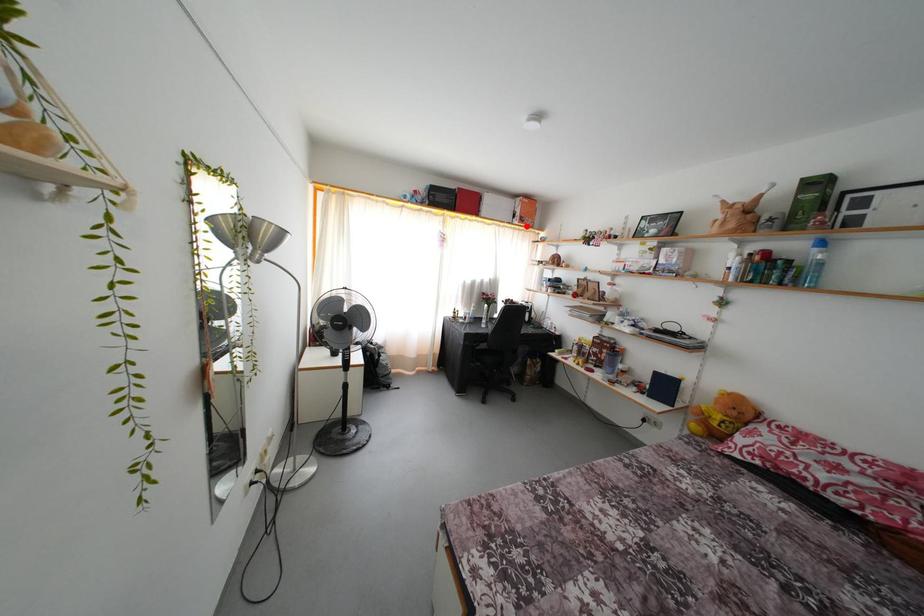
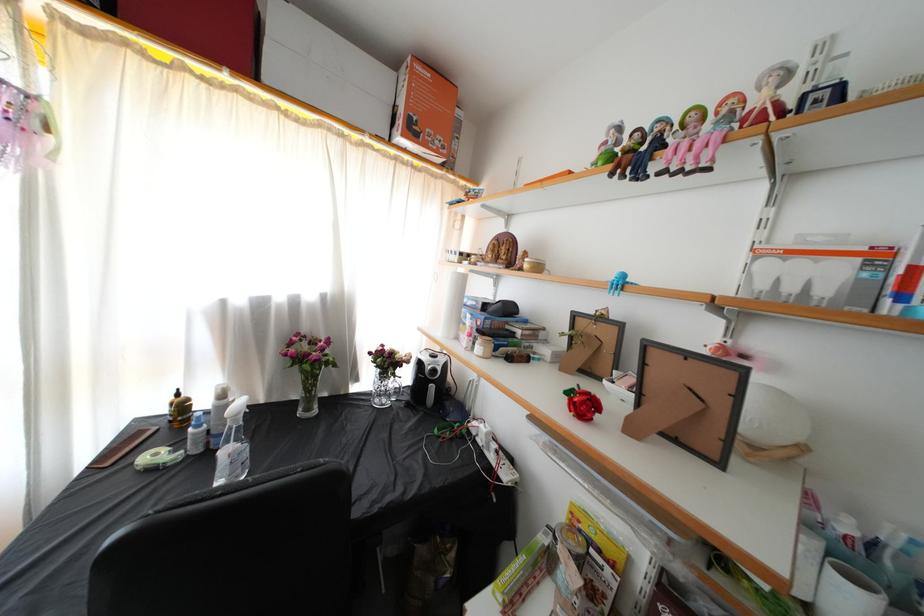
Locate, in the second image, the point that corresponds to the highlighted location in the first image.

(418, 137)